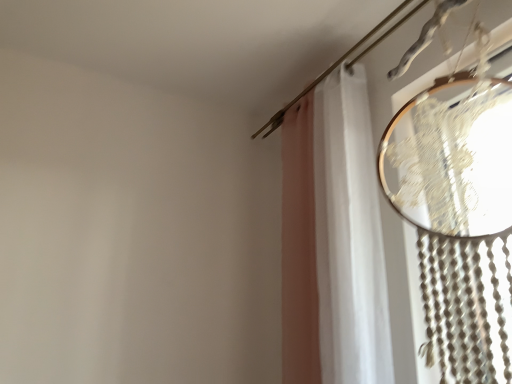
Question: From the image's perspective, is white sheer curtain at upper right under white fabric curtain at right?

Choices:
 (A) yes
 (B) no

Answer: (A)

Question: From a real-world perspective, is white sheer curtain at upper right positioned over white fabric curtain at right based on gravity?

Choices:
 (A) no
 (B) yes

Answer: (A)

Question: Considering the relative sizes of white sheer curtain at upper right and white fabric curtain at right in the image provided, is white sheer curtain at upper right bigger than white fabric curtain at right?

Choices:
 (A) no
 (B) yes

Answer: (B)

Question: Can you confirm if white sheer curtain at upper right is positioned to the left of white fabric curtain at right?

Choices:
 (A) yes
 (B) no

Answer: (A)

Question: Considering the relative sizes of white sheer curtain at upper right and white fabric curtain at right in the image provided, is white sheer curtain at upper right wider than white fabric curtain at right?

Choices:
 (A) yes
 (B) no

Answer: (B)

Question: Is white fabric curtain at right completely or partially inside white sheer curtain at upper right?

Choices:
 (A) no
 (B) yes

Answer: (A)

Question: Is white sheer curtain at upper right at the back of white fabric curtain at right?

Choices:
 (A) yes
 (B) no

Answer: (B)

Question: Does white fabric curtain at right appear on the right side of white sheer curtain at upper right?

Choices:
 (A) yes
 (B) no

Answer: (A)

Question: Does white fabric curtain at right have a lesser height compared to white sheer curtain at upper right?

Choices:
 (A) yes
 (B) no

Answer: (A)

Question: Can white sheer curtain at upper right be found inside white fabric curtain at right?

Choices:
 (A) yes
 (B) no

Answer: (B)

Question: Can you confirm if white fabric curtain at right is smaller than white sheer curtain at upper right?

Choices:
 (A) yes
 (B) no

Answer: (A)

Question: Can you confirm if white fabric curtain at right is bigger than white sheer curtain at upper right?

Choices:
 (A) no
 (B) yes

Answer: (A)

Question: From the image's perspective, is white sheer curtain at upper right above or below white fabric curtain at right?

Choices:
 (A) above
 (B) below

Answer: (B)